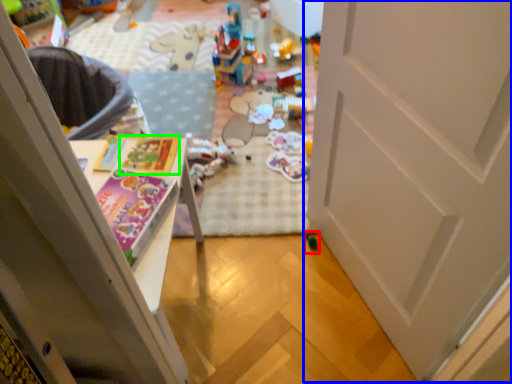
Question: Which object is the farthest from toy (highlighted by a red box)? Choose among these: door (highlighted by a blue box) or magazine (highlighted by a green box).

Choices:
 (A) door
 (B) magazine

Answer: (B)